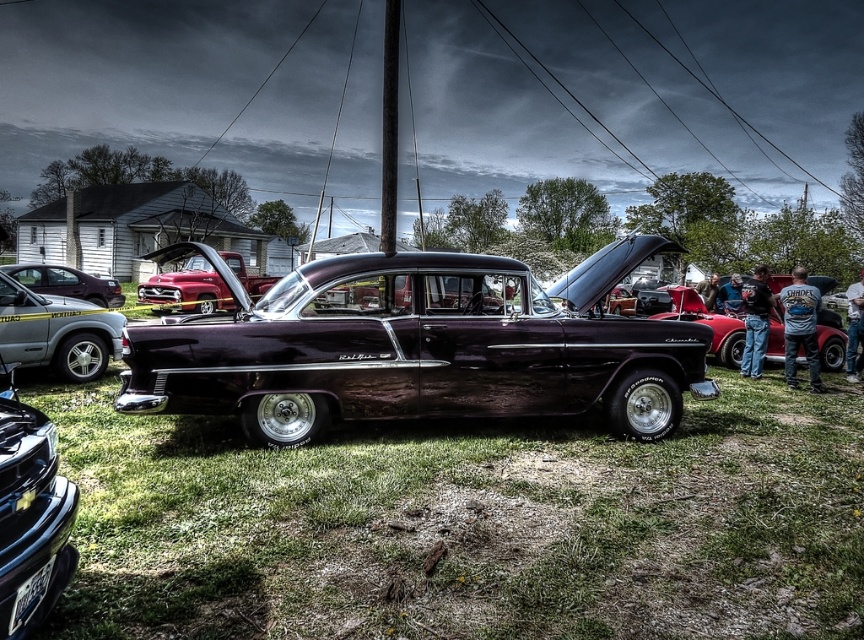
You are a photographer standing at the edge of the car show. You want to capture a photo that includes both the green grass at center and the shiny dark purple car at center. Based on their positions, which object will appear closer to the camera in the photo?

The green grass at center is in front of the shiny dark purple car at center, so it will appear closer to the camera in the photo.

You are a photographer at the car show and want to capture both the shiny dark purple car at center and the shiny metallic car at left in a single frame. Considering their sizes, which car should you position closer to the camera to ensure both appear balanced in the photo?

To balance the image, you should position the shiny metallic car at left closer to the camera since it is smaller than the shiny dark purple car at center, making their apparent sizes more equal.

You are standing at the entrance of the car show and want to take a photo of both point (560, 536) and point (233, 253) in the image. Which point should you focus on first to ensure both are in focus?

You should focus on point (233, 253) first because it is farther from the camera than point (560, 536). By focusing on the farther point, both points will be in focus.